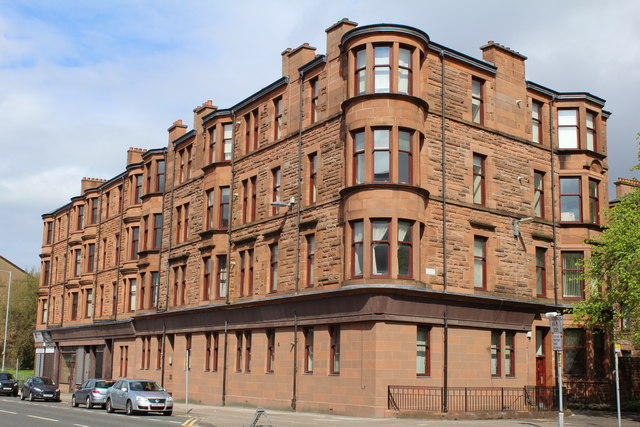
Where is `door`? The height and width of the screenshot is (427, 640). door is located at coordinates (545, 366), (81, 371), (100, 369).